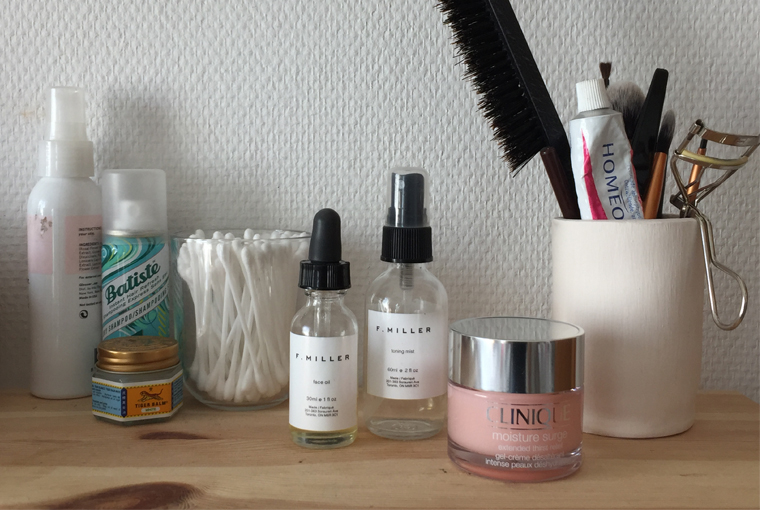
In order to click on metallic jar lids in this screenshot , I will do `click(122, 355)`, `click(523, 367)`.